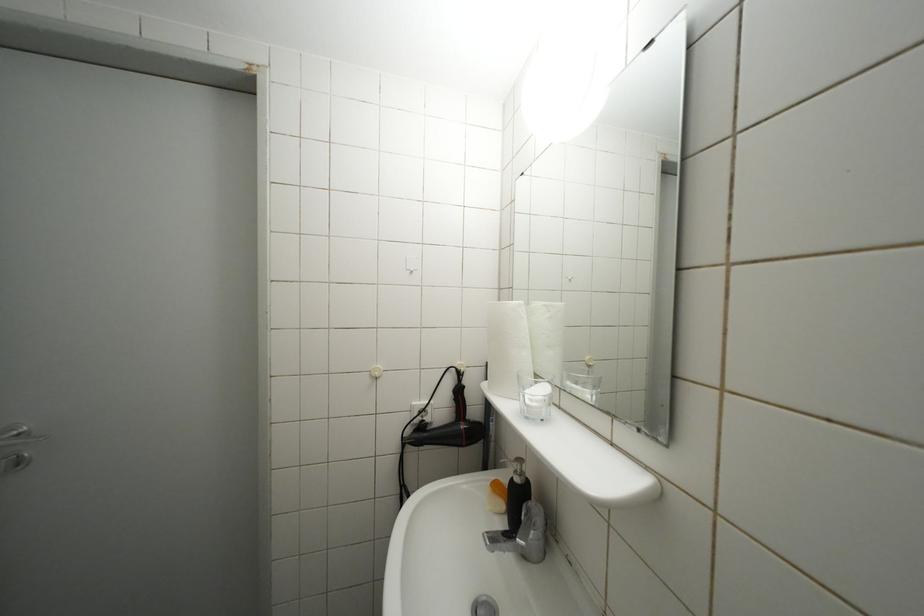
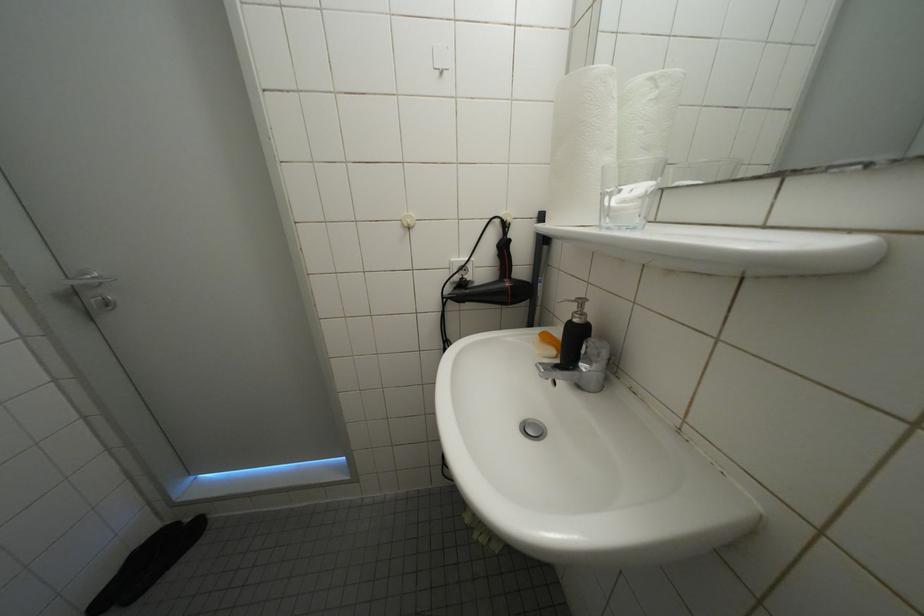
Question: Based on the continuous images, in which direction is the camera rotating? Reply with the corresponding letter.

Choices:
 (A) Left
 (B) Right
 (C) Up
 (D) Down

Answer: (D)